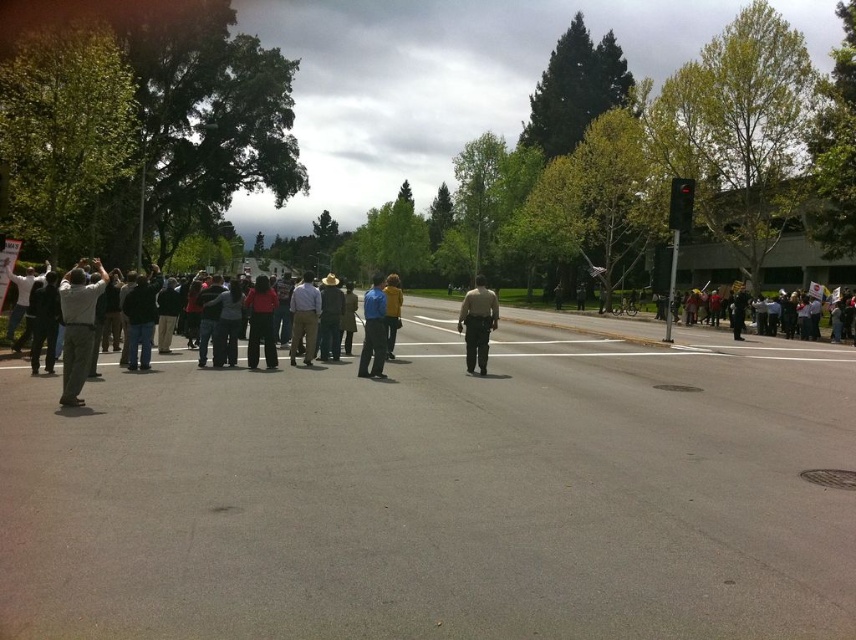
Question: Is dark gray pants at left thinner than yellow fabric sign at right?

Choices:
 (A) yes
 (B) no

Answer: (B)

Question: Among these points, which one is nearest to the camera?

Choices:
 (A) (474, 353)
 (B) (688, 195)
 (C) (385, 330)
 (D) (667, 252)

Answer: (C)

Question: Which object appears closest to the camera in this image?

Choices:
 (A) light brown uniform at center
 (B) red glass traffic light at upper right
 (C) yellow fabric sign at right

Answer: (A)

Question: Can you confirm if dark gray pants at left is bigger than yellow matte jacket at center?

Choices:
 (A) yes
 (B) no

Answer: (A)

Question: In this image, where is blue shirt at center located relative to black plastic traffic light at upper center?

Choices:
 (A) above
 (B) below

Answer: (A)

Question: Based on their relative distances, which object is farther from the black plastic traffic light at upper center?

Choices:
 (A) dark gray pants at left
 (B) blue shirt at center

Answer: (B)